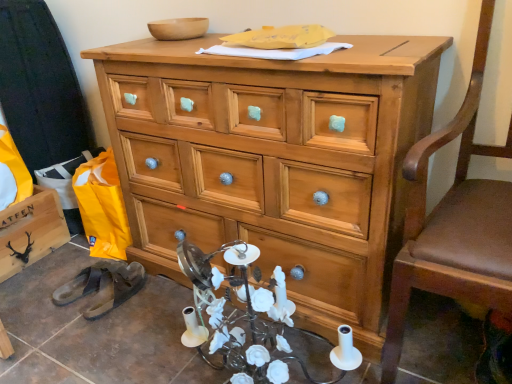
Question: In terms of size, does black rubber sandals at lower left appear bigger or smaller than black matte wooden cabinet at lower left?

Choices:
 (A) big
 (B) small

Answer: (B)

Question: In terms of width, does black rubber sandals at lower left look wider or thinner when compared to black matte wooden cabinet at lower left?

Choices:
 (A) thin
 (B) wide

Answer: (A)

Question: Which object is positioned farthest from the brown leather swivel chair at right?

Choices:
 (A) black matte wooden cabinet at lower left
 (B) natural wood chest of drawers at center
 (C) black rubber sandals at lower left

Answer: (A)

Question: Considering the real-world distances, which object is farthest from the black matte wooden cabinet at lower left?

Choices:
 (A) brown leather swivel chair at right
 (B) black rubber sandals at lower left
 (C) natural wood chest of drawers at center

Answer: (A)